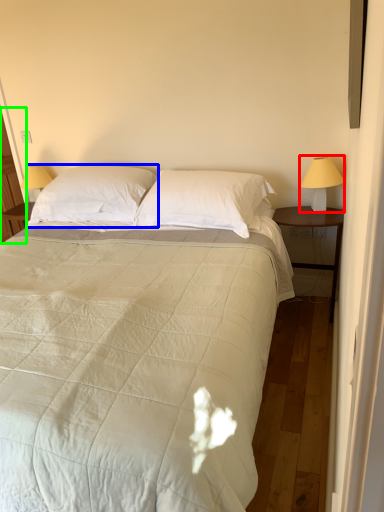
Question: Based on their relative distances, which object is nearer to bedside lamp (highlighted by a red box)? Choose from pillow (highlighted by a blue box) and screen door (highlighted by a green box).

Choices:
 (A) pillow
 (B) screen door

Answer: (A)